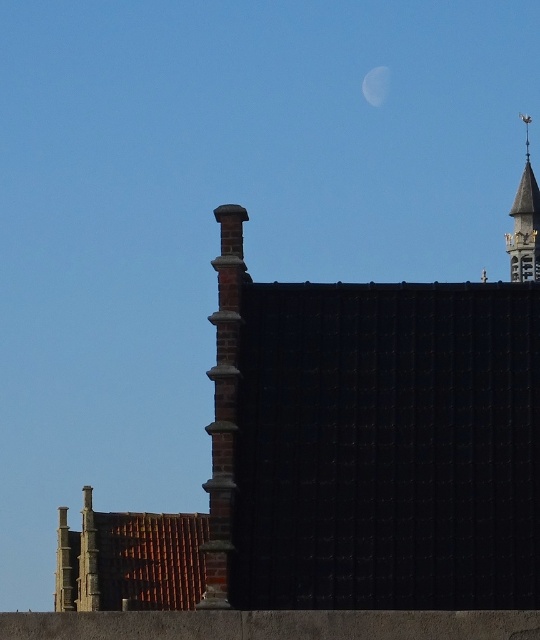
From the picture: Between polished brass bell tower at upper right and silver metallic moon at upper center, which one appears on the left side from the viewer's perspective?

Positioned to the left is silver metallic moon at upper center.

Who is positioned more to the right, polished brass bell tower at upper right or silver metallic moon at upper center?

From the viewer's perspective, polished brass bell tower at upper right appears more on the right side.

Describe the element at coordinates (524, 221) in the screenshot. The height and width of the screenshot is (640, 540). I see `polished brass bell tower at upper right` at that location.

The width and height of the screenshot is (540, 640). In order to click on polished brass bell tower at upper right in this screenshot , I will do `click(524, 221)`.